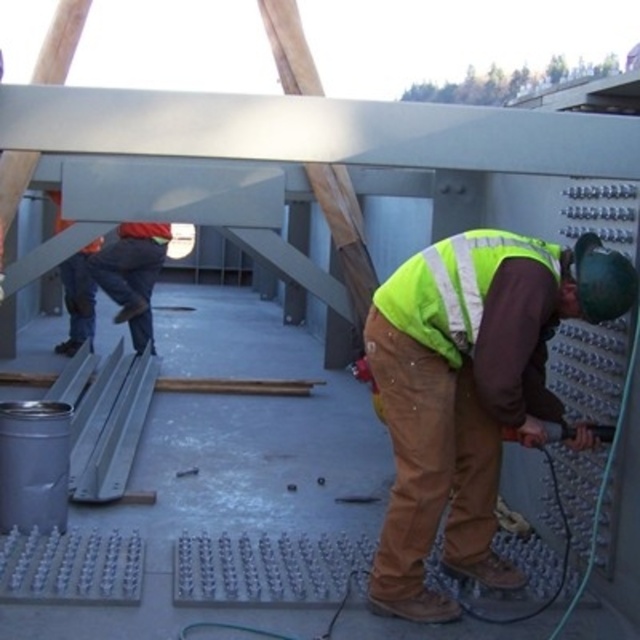
Question: Is the position of high visibility yellow safety vest at lower right more distant than that of orange reflective vest at upper left?

Choices:
 (A) no
 (B) yes

Answer: (A)

Question: Is high visibility yellow safety vest at lower right bigger than orange reflective vest at upper left?

Choices:
 (A) no
 (B) yes

Answer: (B)

Question: Among these points, which one is nearest to the camera?

Choices:
 (A) (145, 250)
 (B) (420, 310)

Answer: (B)

Question: Does high visibility yellow safety vest at lower right come in front of orange reflective vest at upper left?

Choices:
 (A) yes
 (B) no

Answer: (A)